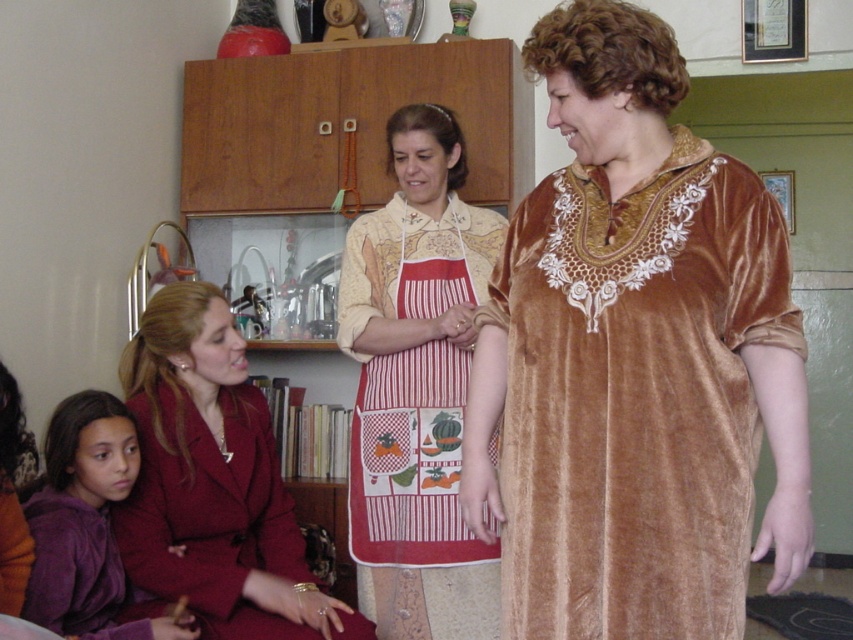
Question: Considering the relative positions of velvet maroon blazer at lower left and purple velvet sweater at lower left in the image provided, where is velvet maroon blazer at lower left located with respect to purple velvet sweater at lower left?

Choices:
 (A) left
 (B) right

Answer: (B)

Question: Which object is the farthest from the velvet gold dress at center?

Choices:
 (A) velvet maroon blazer at lower left
 (B) striped apron at center

Answer: (A)

Question: Which point is farther to the camera?

Choices:
 (A) purple velvet sweater at lower left
 (B) striped apron at center

Answer: (B)

Question: Observing the image, what is the correct spatial positioning of velvet gold dress at center in reference to purple velvet sweater at lower left?

Choices:
 (A) left
 (B) right

Answer: (B)

Question: Can you confirm if velvet maroon blazer at lower left is positioned above purple velvet sweater at lower left?

Choices:
 (A) no
 (B) yes

Answer: (B)

Question: Which object is positioned closest to the striped apron at center?

Choices:
 (A) purple velvet sweater at lower left
 (B) velvet maroon blazer at lower left

Answer: (B)